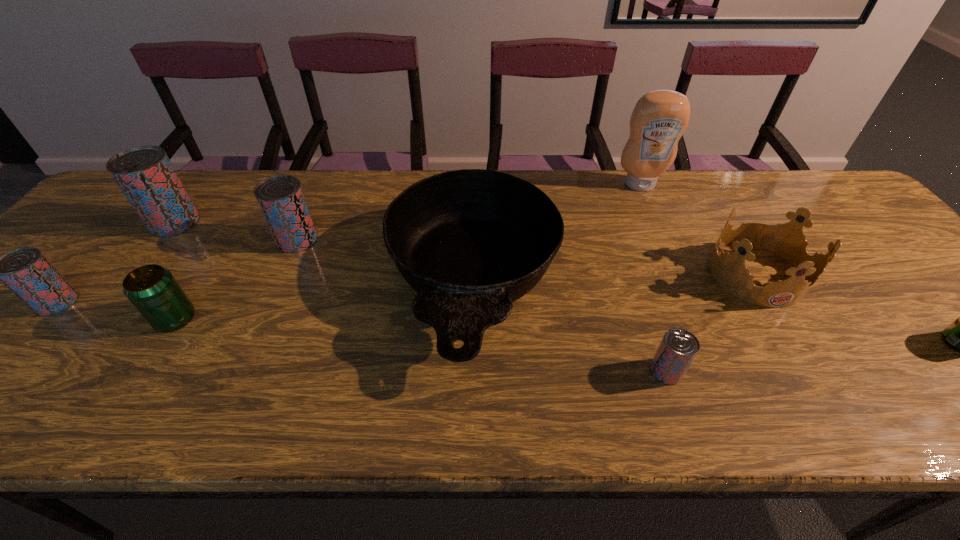
Identify which beer can is located as the second nearest to the smallest red beer can. Please provide its 2D coordinates. Your answer should be formatted as a tuple, i.e. [(x, y)], where the tuple contains the x and y coordinates of a point satisfying the conditions above.

[(281, 199)]

You are a GUI agent. You are given a task and a screenshot of the screen. Output one action in this format:
    pyautogui.click(x=<x>, y=<y>)
    Task: Click on the beer can that can be found as the fifth closest to the third smallest red beer can
    Image resolution: width=960 pixels, height=540 pixels.
    Given the screenshot: What is the action you would take?
    pyautogui.click(x=959, y=335)

At what (x,y) coordinates should I click in order to perform the action: click on red beer can that can be found as the closest to the rightmost object. Please return your answer as a coordinate pair (x, y). The image size is (960, 540). Looking at the image, I should click on (678, 348).

I want to click on the third closest red beer can to the third red beer can from right to left, so click(678, 348).

What are the coordinates of `free location that satisfies the following two spatial constraints: 1. with the handle extending from the side of the nearest red beer can; 2. on the right side of the fifth object from left to right` in the screenshot? It's located at (472, 371).

Identify the location of free point that satisfies the following two spatial constraints: 1. on the front side of the second object from left to right; 2. on the left side of the third beer can from left to right. (102, 319).